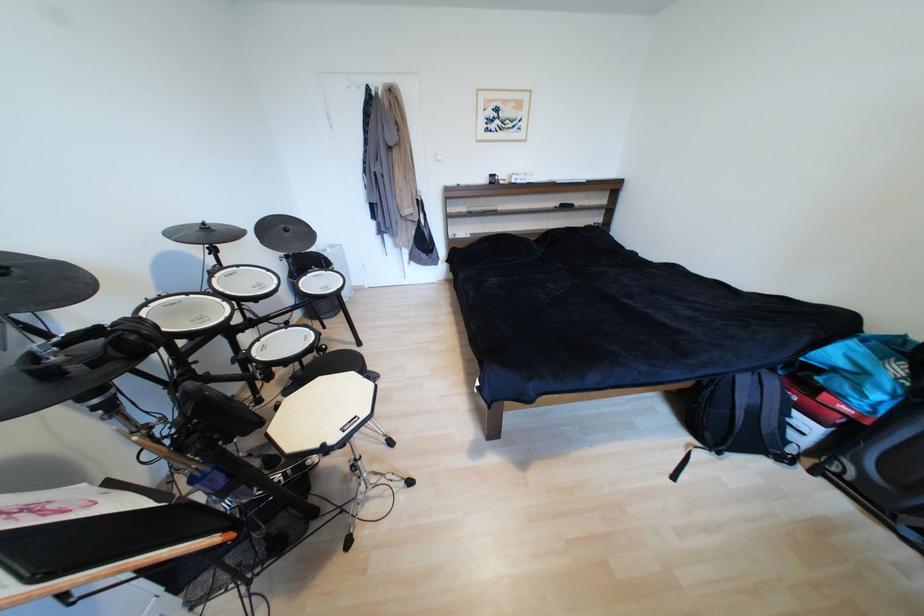
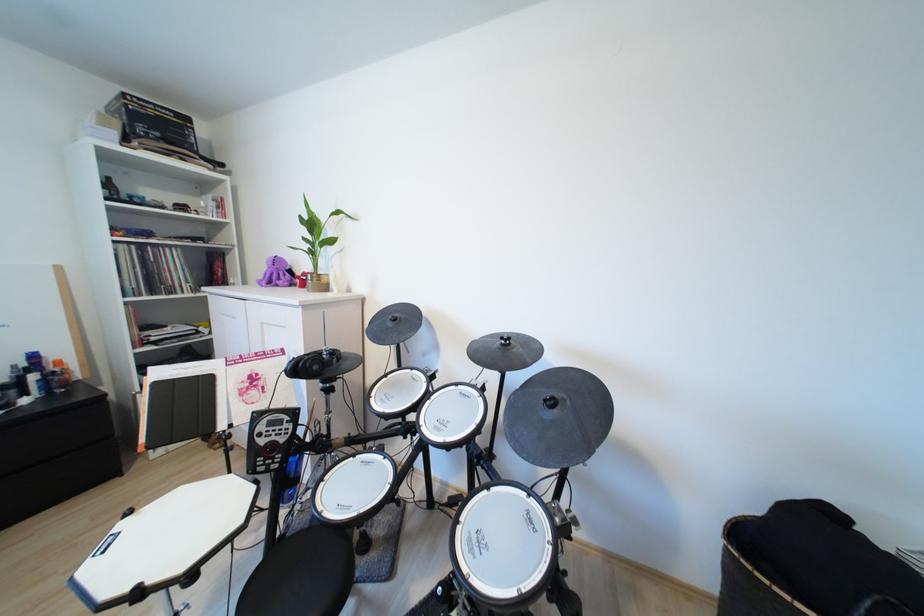
Where in the second image is the point corresponding to point 293,231 from the first image?

(560, 405)